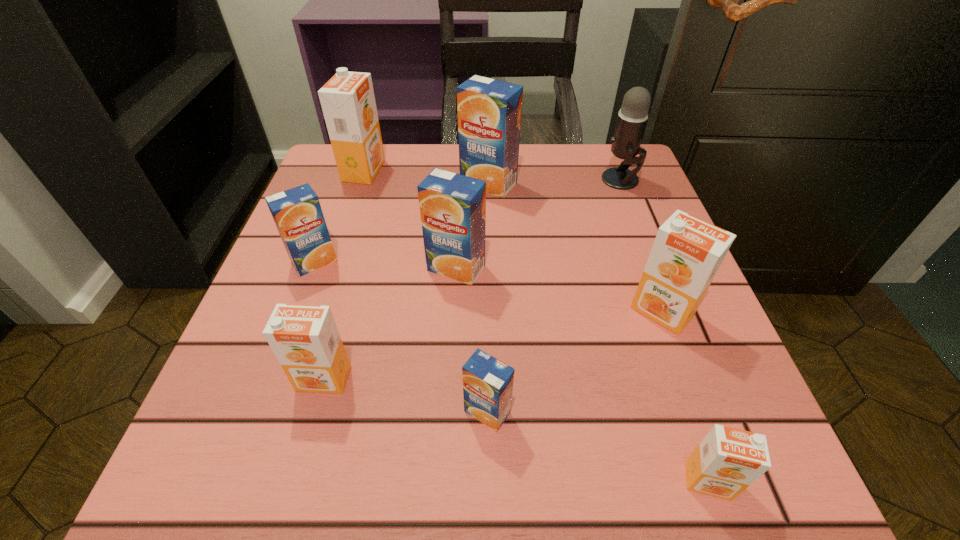
This screenshot has width=960, height=540. I want to click on vacant area between the farthest orange orange juice and the second biggest blue orange_juice, so click(410, 219).

This screenshot has height=540, width=960. Find the location of `empty space between the second biggest blue orange_juice and the fourth nearest orange juice`. empty space between the second biggest blue orange_juice and the fourth nearest orange juice is located at coordinates (560, 289).

Locate an element on the screen. This screenshot has height=540, width=960. free space between the third smallest blue orange_juice and the biggest orange orange juice is located at coordinates (410, 219).

This screenshot has height=540, width=960. What are the coordinates of `vacant region between the biggest orange orange juice and the third biggest orange orange juice` in the screenshot? It's located at (344, 274).

Identify the location of free space between the biggest blue orange_juice and the gray microphone. (555, 182).

You are a GUI agent. You are given a task and a screenshot of the screen. Output one action in this format:
    pyautogui.click(x=<x>, y=<y>)
    Task: Click on the free spot between the third smallest blue orange_juice and the third biggest blue orange_juice
    Image resolution: width=960 pixels, height=540 pixels.
    Given the screenshot: What is the action you would take?
    click(x=385, y=265)

Locate an element on the screen. The width and height of the screenshot is (960, 540). vacant area that lies between the microphone and the smallest orange orange juice is located at coordinates (664, 330).

Where is `free space that is in between the second biggest blue orange_juice and the fifth farthest orange juice`? free space that is in between the second biggest blue orange_juice and the fifth farthest orange juice is located at coordinates (560, 289).

Identify the location of free spot between the nearest blue orange_juice and the fourth nearest object. (575, 361).

Select which object is the eighth closest to the third smallest blue orange_juice. Please provide its 2D coordinates. Your answer should be formatted as a tuple, i.e. [(x, y)], where the tuple contains the x and y coordinates of a point satisfying the conditions above.

[(727, 461)]